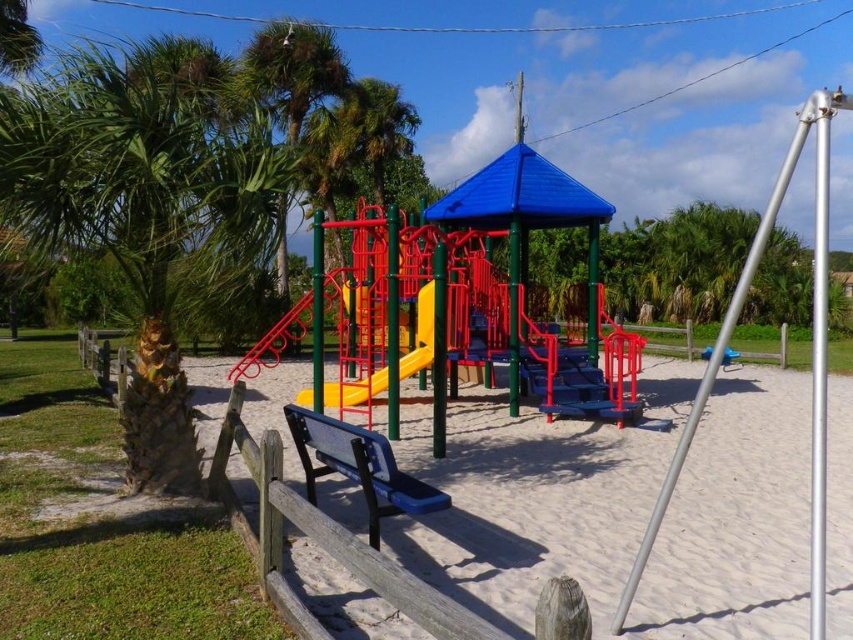
You are standing at the playground and want to take a photo of both the point at coordinates point [70,147] and the point at coordinates point [813,291]. Which point will appear larger in your camera view?

Point [70,147] is closer to the camera than point [813,291], so it will appear larger in the camera view.

You are a parent trying to locate your child who is hiding behind an object in the playground. You see the green leafy palm tree at left and the silver metallic pole at right. Which object can your child hide behind so that they are completely out of your sight?

The child can hide completely behind the silver metallic pole at right because it is positioned behind the green leafy palm tree at left, meaning it is farther away from you. If the child hides behind the pole, they would be obscured from view by the palm tree, but since the pole is behind the tree, the tree would block the view of the pole and anything behind it.